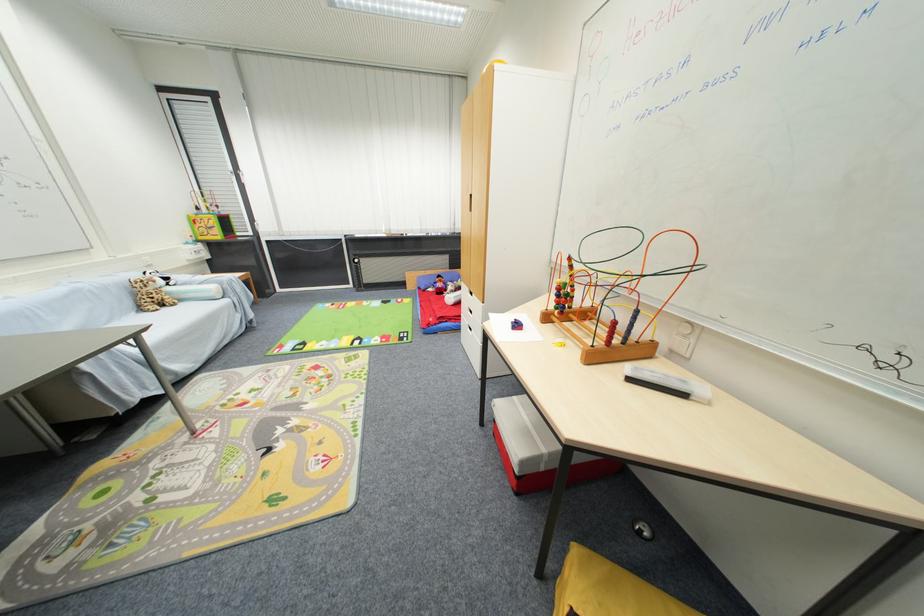
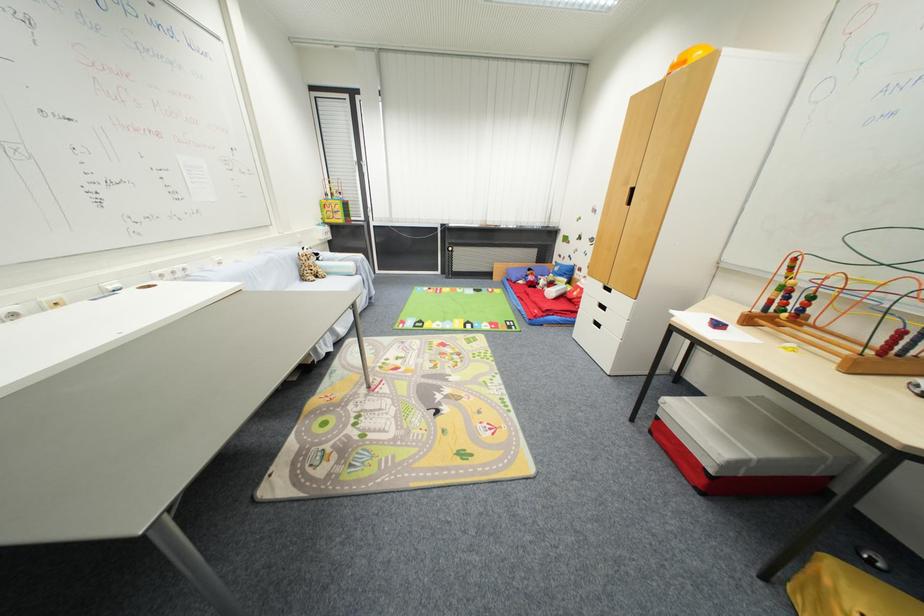
Question: The camera is either moving clockwise (left) or counter-clockwise (right) around the object. The first image is from the beginning of the video and the second image is from the end. Is the camera moving left or right when shooting the video?

Choices:
 (A) Left
 (B) Right

Answer: (B)